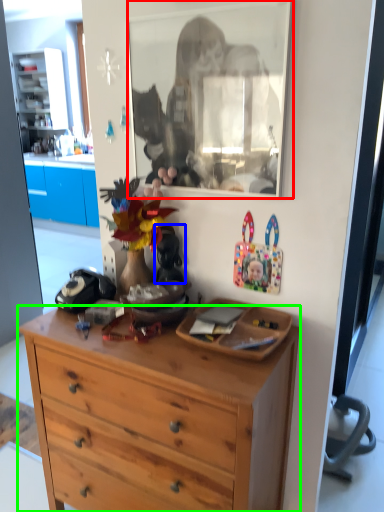
Question: Which object is positioned farthest from mirror (highlighted by a red box)? Select from toy (highlighted by a blue box) and desk (highlighted by a green box).

Choices:
 (A) toy
 (B) desk

Answer: (B)